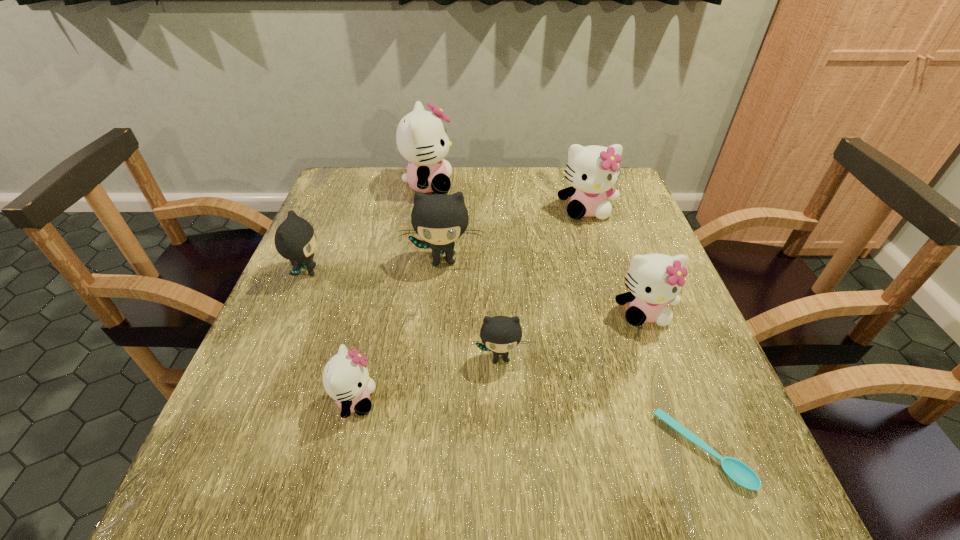
You are a GUI agent. You are given a task and a screenshot of the screen. Output one action in this format:
    pyautogui.click(x=<x>, y=<y>)
    Task: Click on the vacant region between the smallest white kitten and the leftmost object
    This screenshot has height=540, width=960.
    Given the screenshot: What is the action you would take?
    pyautogui.click(x=331, y=336)

The width and height of the screenshot is (960, 540). In order to click on object that is the seventh closest to the tallest kitten in this screenshot , I will do `click(737, 471)`.

Where is `object that can be found as the seventh closest to the leftmost kitten`? The width and height of the screenshot is (960, 540). object that can be found as the seventh closest to the leftmost kitten is located at coordinates (737, 471).

This screenshot has height=540, width=960. I want to click on kitten that stands as the third closest to the fourth nearest object, so click(439, 219).

Identify the location of kitten that is the closest to the sixth farthest object. The width and height of the screenshot is (960, 540). (346, 379).

This screenshot has height=540, width=960. Identify the location of the third closest white kitten to the third smallest white kitten. (346, 379).

Where is `white kitten that is the third closest to the nearest white kitten`? The height and width of the screenshot is (540, 960). white kitten that is the third closest to the nearest white kitten is located at coordinates (592, 171).

This screenshot has height=540, width=960. What are the coordinates of `gray kitten that can be found as the second closest to the second nearest kitten` in the screenshot? It's located at 295,240.

Locate an element on the screen. This screenshot has width=960, height=540. gray kitten that stands as the third closest to the second smallest white kitten is located at coordinates (295, 240).

You are a GUI agent. You are given a task and a screenshot of the screen. Output one action in this format:
    pyautogui.click(x=<x>, y=<y>)
    Task: Click on the vacant space that satisfies the following two spatial constraints: 1. on the front-facing side of the third biggest white kitten; 2. on the front-facing side of the nearest white kitten
    
    Given the screenshot: What is the action you would take?
    pyautogui.click(x=676, y=400)